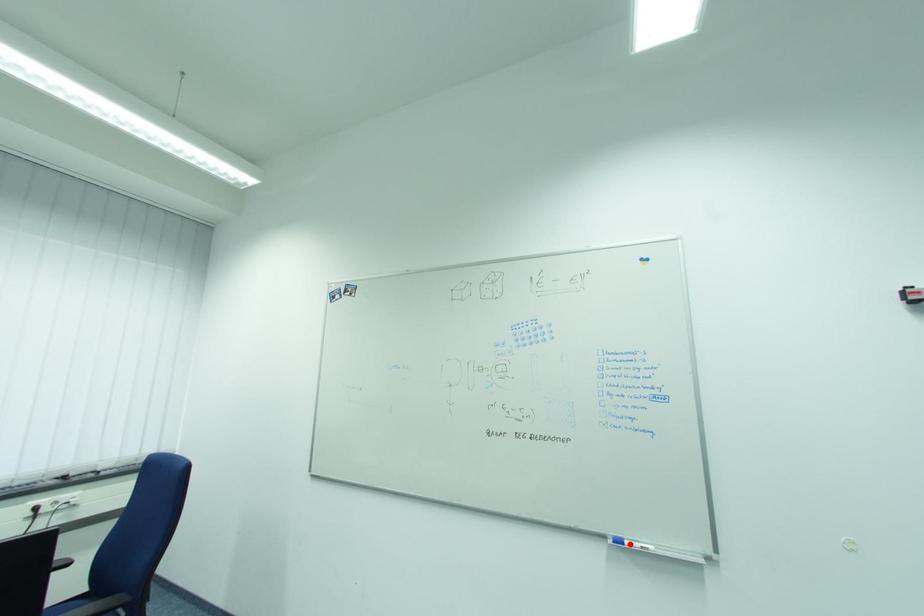
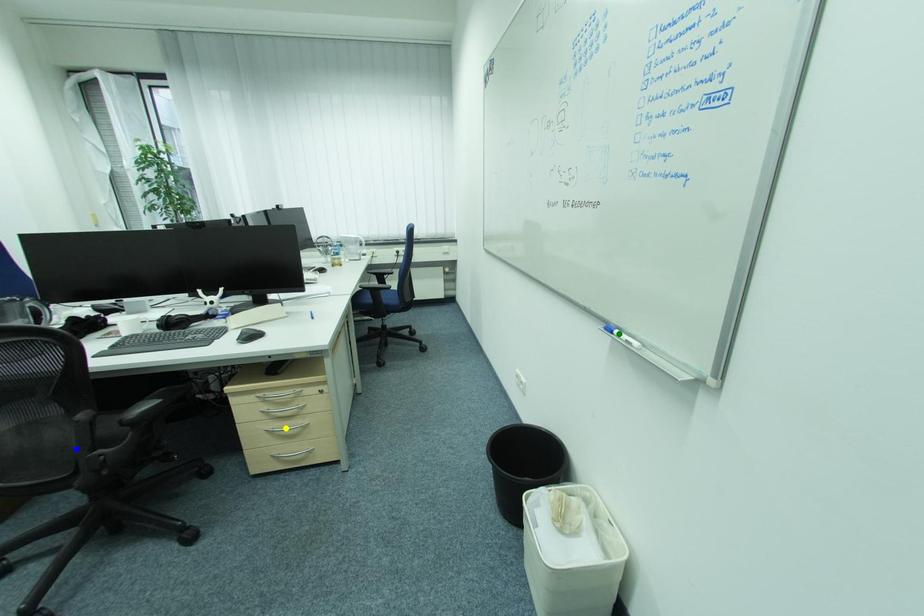
Question: I am providing you with two images of the same scene from different viewpoints. A red point is marked on the first image. You are given multiple points on the second image. Which point in image 2 is actually the same real-world point as the red point in image 1?

Choices:
 (A) yellow point
 (B) blue point
 (C) green point

Answer: (C)